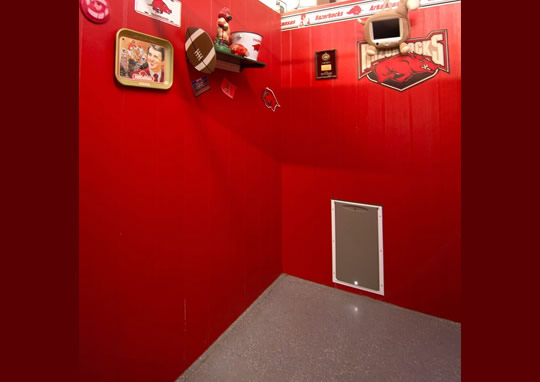
Identify the location of wall flap. (354, 264).